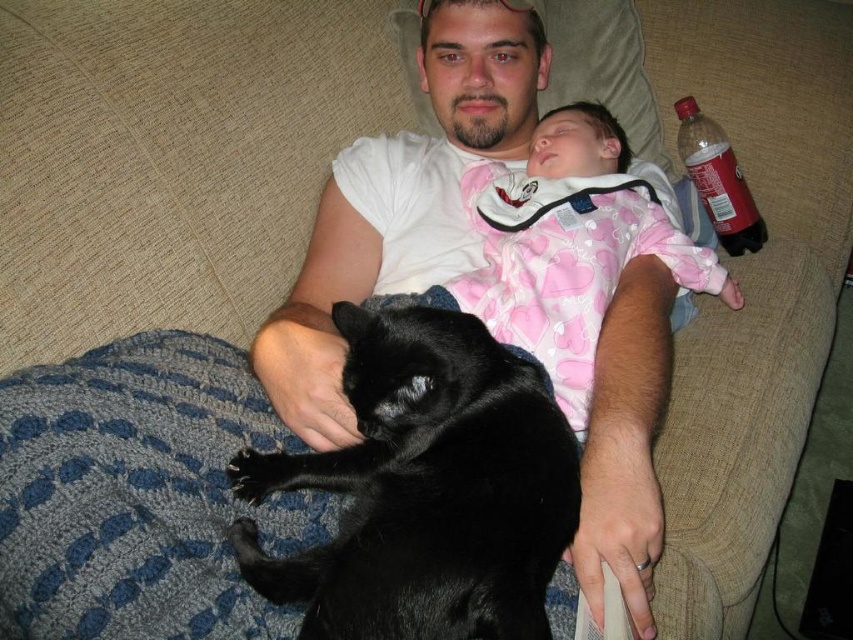
Is pink cotton onesie at upper center positioned at the back of red matte soda bottle at upper right?

No, pink cotton onesie at upper center is closer to the viewer.

Measure the distance between pink cotton onesie at upper center and red matte soda bottle at upper right.

11.45 inches

The height and width of the screenshot is (640, 853). What do you see at coordinates (569, 244) in the screenshot? I see `pink cotton onesie at upper center` at bounding box center [569, 244].

Identify the location of pink cotton onesie at upper center. Image resolution: width=853 pixels, height=640 pixels. (569, 244).

Which is above, shiny black cat at center or pink cotton onesie at upper center?

Positioned higher is pink cotton onesie at upper center.

Does shiny black cat at center appear over pink cotton onesie at upper center?

No, shiny black cat at center is not above pink cotton onesie at upper center.

This screenshot has height=640, width=853. Describe the element at coordinates (425, 488) in the screenshot. I see `shiny black cat at center` at that location.

Where is `shiny black cat at center`? The image size is (853, 640). shiny black cat at center is located at coordinates (425, 488).

Which is above, shiny black cat at center or red matte soda bottle at upper right?

red matte soda bottle at upper right

Is shiny black cat at center above red matte soda bottle at upper right?

Actually, shiny black cat at center is below red matte soda bottle at upper right.

Find the location of a particular element. shiny black cat at center is located at coordinates (425, 488).

The image size is (853, 640). Find the location of `shiny black cat at center`. shiny black cat at center is located at coordinates (425, 488).